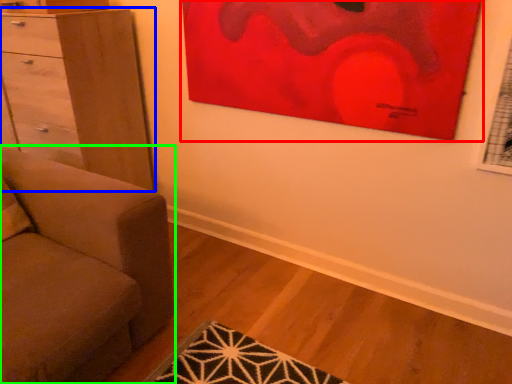
Question: Estimate the real-world distances between objects in this image. Which object is farther from picture frame (highlighted by a red box), chest of drawers (highlighted by a blue box) or studio couch (highlighted by a green box)?

Choices:
 (A) chest of drawers
 (B) studio couch

Answer: (B)